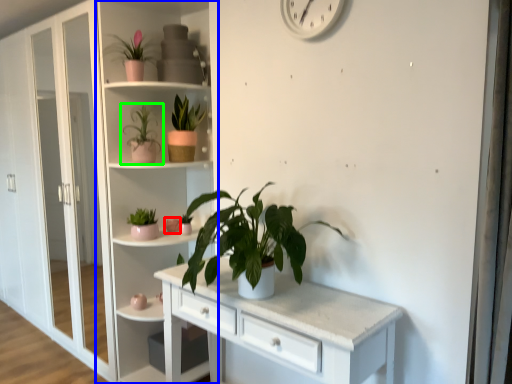
Question: Based on their relative distances, which object is farther from flower (highlighted by a red box)? Choose from bookshelf (highlighted by a blue box) and houseplant (highlighted by a green box).

Choices:
 (A) bookshelf
 (B) houseplant

Answer: (A)